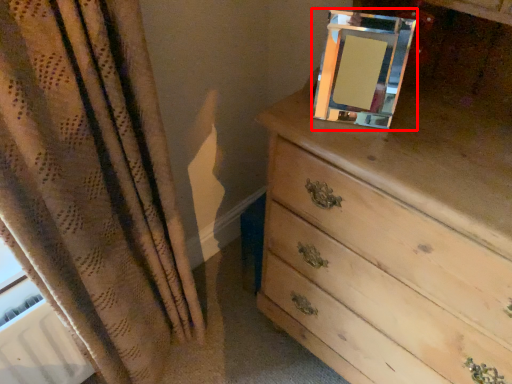
Question: From the image's perspective, where is picture frame (annotated by the red box) located in relation to chest of drawers in the image?

Choices:
 (A) above
 (B) below

Answer: (A)